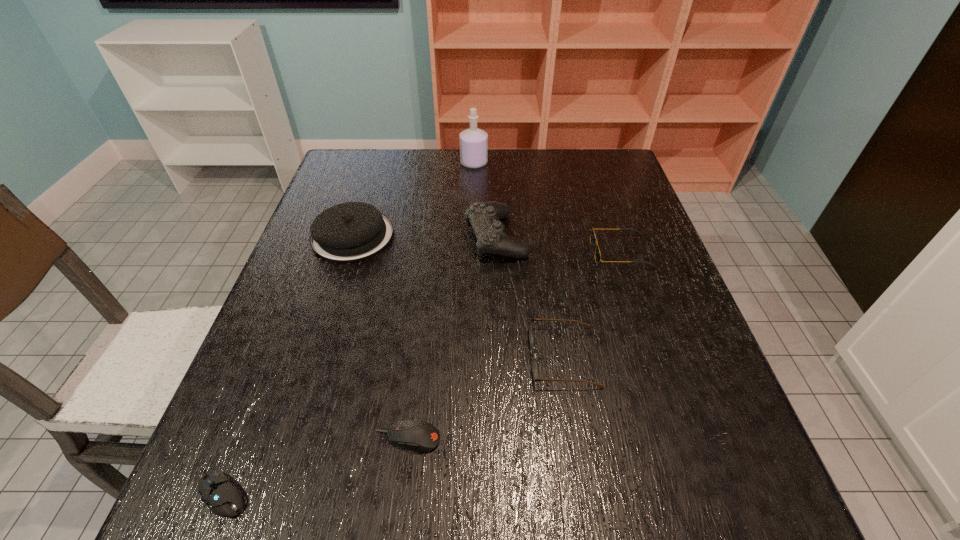
I want to click on free region located 0.230m on the right of the farther computer mouse, so click(574, 438).

Where is `vacant space located on the right of the nearest object`? Image resolution: width=960 pixels, height=540 pixels. vacant space located on the right of the nearest object is located at coordinates coord(484,493).

Locate an element on the screen. This screenshot has height=540, width=960. object located in the far edge section of the desktop is located at coordinates (473, 141).

This screenshot has width=960, height=540. I want to click on object that is at the near edge, so click(x=222, y=497).

This screenshot has width=960, height=540. I want to click on pancake that is at the left edge, so pyautogui.click(x=352, y=231).

Find the location of `computer mouse at the left edge`. computer mouse at the left edge is located at coordinates (222, 497).

Where is `object situated at the right edge`? This screenshot has width=960, height=540. object situated at the right edge is located at coordinates (593, 239).

Where is `object located in the near left corner section of the desktop`? This screenshot has height=540, width=960. object located in the near left corner section of the desktop is located at coordinates (222, 497).

The width and height of the screenshot is (960, 540). In order to click on vacant space at the far edge in this screenshot , I will do `click(452, 151)`.

Locate an element on the screen. The width and height of the screenshot is (960, 540). vacant space at the near edge of the desktop is located at coordinates (518, 524).